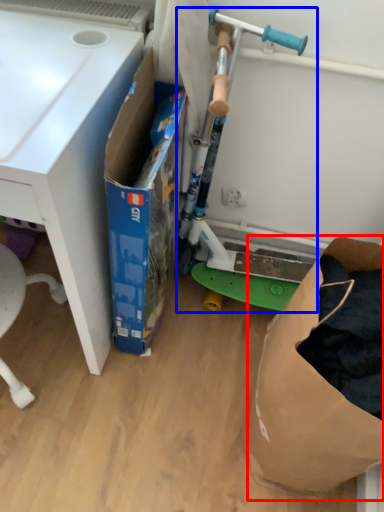
Question: Among these objects, which one is farthest to the camera, paper bag (highlighted by a red box) or appliance (highlighted by a blue box)?

Choices:
 (A) paper bag
 (B) appliance

Answer: (B)